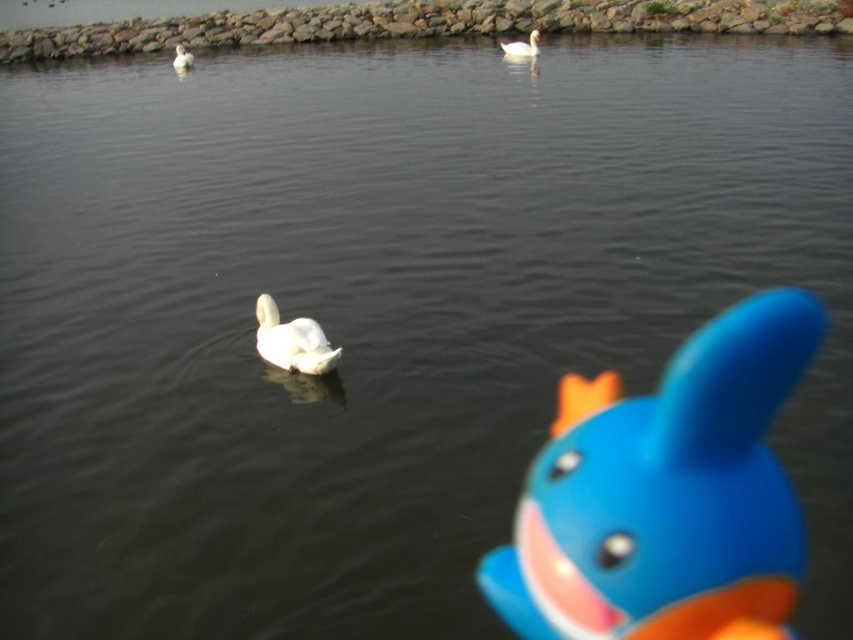
Does white matte swan at upper center appear under blue rubber duck at center?

Yes, white matte swan at upper center is below blue rubber duck at center.

Is white matte swan at upper center bigger than blue rubber duck at center?

Yes.

Between point (498, 44) and point (175, 45), which one is positioned in front?

Point (175, 45)

Where is `white matte swan at upper center`? The height and width of the screenshot is (640, 853). white matte swan at upper center is located at coordinates (521, 45).

From the picture: Which of these two, blue rubber duck at right or blue rubber duck at center, stands shorter?

Standing shorter between the two is blue rubber duck at right.

Is point (700, 593) behind point (180, 58)?

No, it is not.

Between point (621, 403) and point (173, 64), which one is positioned behind?

Point (173, 64)

Where is `blue rubber duck at right`? blue rubber duck at right is located at coordinates (665, 493).

Between white matte swan at center and white matte swan at upper center, which one appears on the left side from the viewer's perspective?

white matte swan at center

Is white matte swan at center smaller than white matte swan at upper center?

Correct, white matte swan at center occupies less space than white matte swan at upper center.

Image resolution: width=853 pixels, height=640 pixels. Describe the element at coordinates (292, 340) in the screenshot. I see `white matte swan at center` at that location.

Identify the location of white matte swan at center. The height and width of the screenshot is (640, 853). (292, 340).